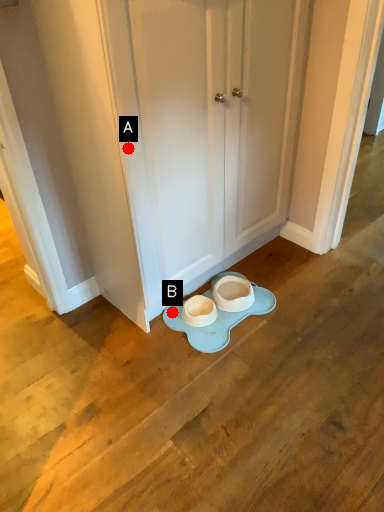
Question: Two points are circled on the image, labeled by A and B beside each circle. Which of the following is the farthest from the observer?

Choices:
 (A) A is further
 (B) B is further

Answer: (B)